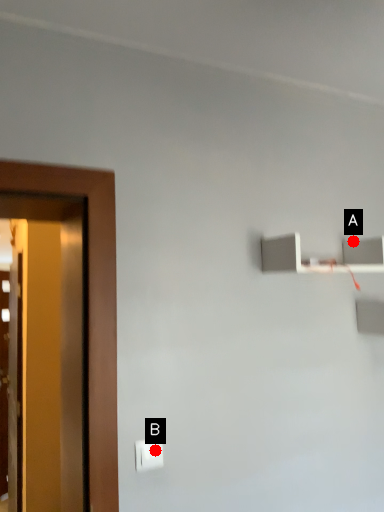
Question: Two points are circled on the image, labeled by A and B beside each circle. Which point is further to the camera?

Choices:
 (A) A is further
 (B) B is further

Answer: (A)